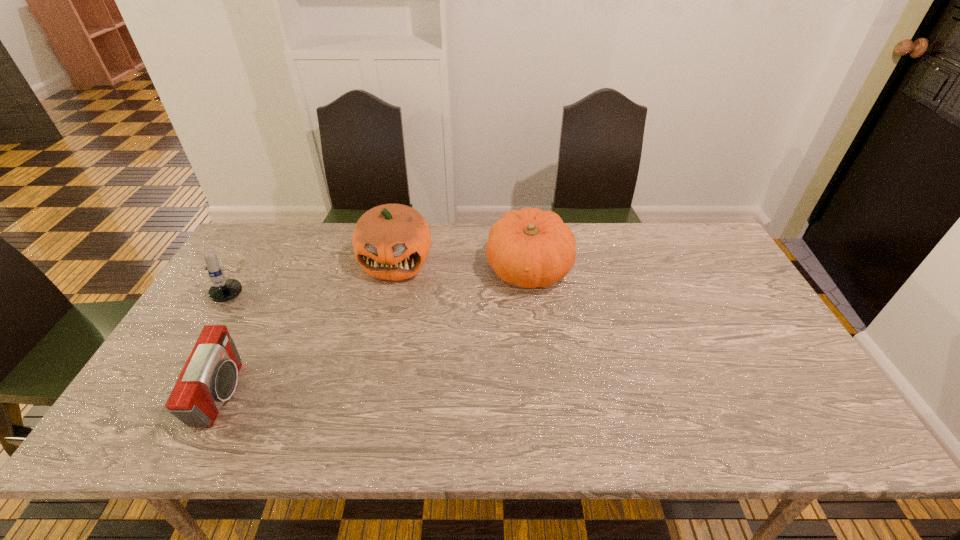
This screenshot has height=540, width=960. Find the location of `vacant space that satisfies the following two spatial constraints: 1. on the back side of the rightmost object; 2. on the right side of the leftmost object`. vacant space that satisfies the following two spatial constraints: 1. on the back side of the rightmost object; 2. on the right side of the leftmost object is located at coordinates (246, 269).

Image resolution: width=960 pixels, height=540 pixels. I want to click on vacant space that satisfies the following two spatial constraints: 1. on the face of the right pumpkin; 2. on the right side of the left pumpkin, so pos(394,269).

Identify the location of blank area in the image that satisfies the following two spatial constraints: 1. on the face of the left pumpkin; 2. on the front-facing side of the shortest object. The width and height of the screenshot is (960, 540). (367, 394).